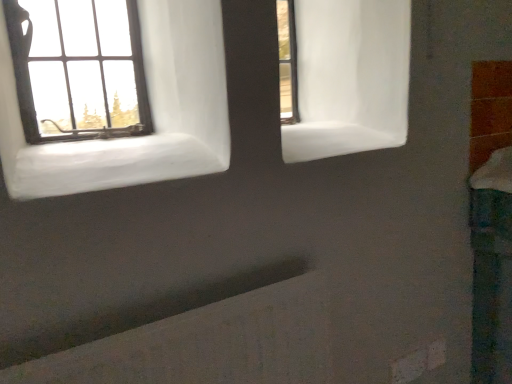
Identify the location of free location to the right of matte black window at upper left. Image resolution: width=512 pixels, height=384 pixels. (145, 134).